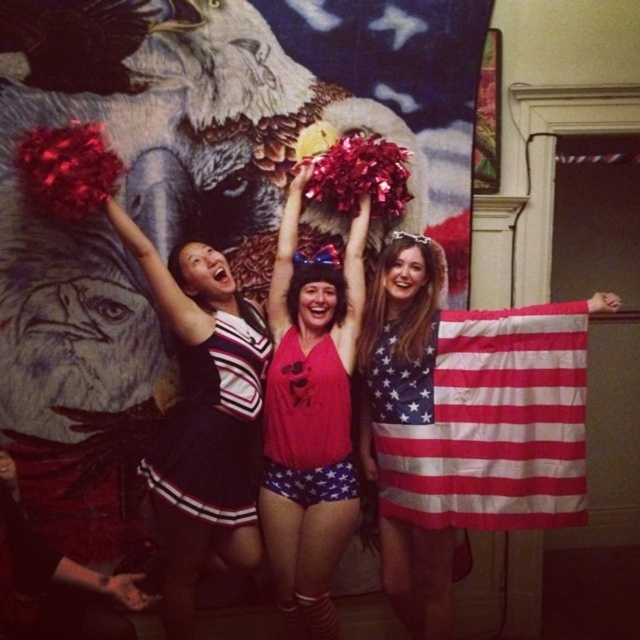
You are planning to take a photo of the american flag at center and the red fabric dress at center for a magazine spread. The editor wants to highlight the size difference between them. Which object should be placed closer to the camera to emphasize their size difference?

To emphasize the size difference between the american flag at center and the red fabric dress at center, the american flag at center should be placed closer to the camera since it is larger than the red fabric dress at center.

You are a photographer trying to capture a clear shot of the American flag at center and the red fabric dress at center. Which object is closer to the camera based on their positions?

The red fabric dress at center is closer to the camera because the American flag at center is positioned under it, indicating it is behind.

You are attending a patriotic event and notice the american flag at center and the red fabric dress at center. Which one has a greater width?

The american flag at center has a greater width than the red fabric dress at center.